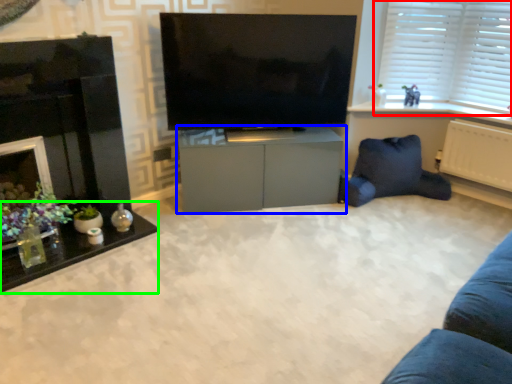
Question: Based on their relative distances, which object is farther from window (highlighted by a red box)? Choose from cabinetry (highlighted by a blue box) and table (highlighted by a green box).

Choices:
 (A) cabinetry
 (B) table

Answer: (B)